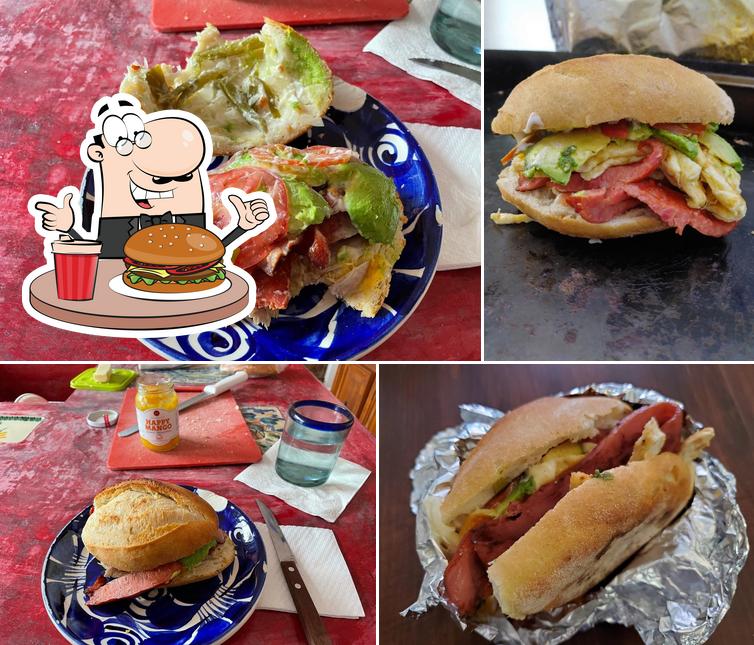
Locate an element on the screen. The height and width of the screenshot is (645, 754). napkin is located at coordinates (328, 553), (323, 491), (467, 233), (400, 40).